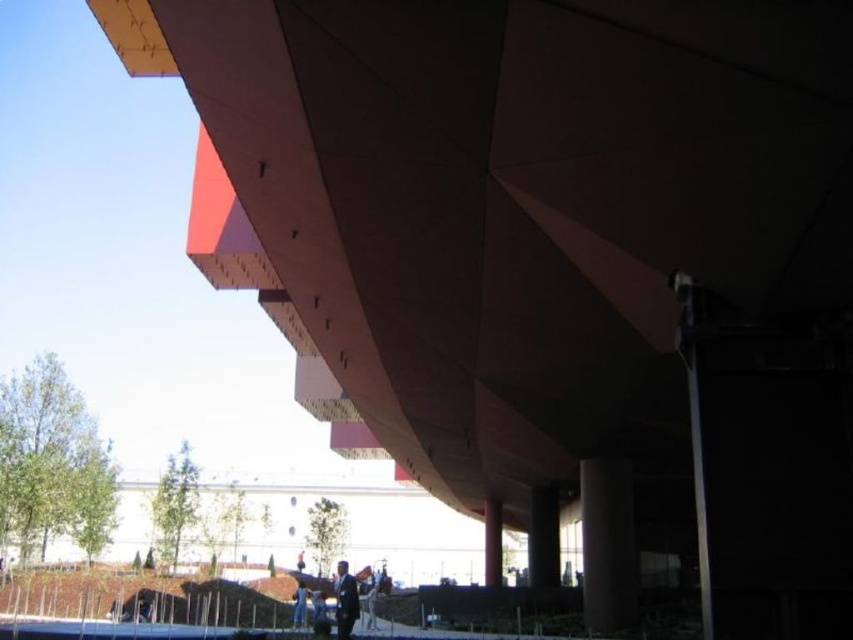
Question: Is smooth concrete pillar at center above dark blue suit at lower center?

Choices:
 (A) no
 (B) yes

Answer: (A)

Question: Which of the following is the closest to the observer?

Choices:
 (A) (143, 618)
 (B) (345, 570)

Answer: (B)

Question: Where is smooth concrete pillar at center located in relation to dark suit at lower center in the image?

Choices:
 (A) right
 (B) left

Answer: (A)

Question: Is smooth concrete pillar at center wider than dark blue suit at center?

Choices:
 (A) no
 (B) yes

Answer: (A)

Question: Among these points, which one is farthest from the camera?

Choices:
 (A) (369, 620)
 (B) (486, 506)
 (C) (606, 593)

Answer: (B)

Question: Estimate the real-world distances between objects in this image. Which object is farther from the dark suit at lower center?

Choices:
 (A) dark blue suit at lower center
 (B) dark gray suit at center

Answer: (A)